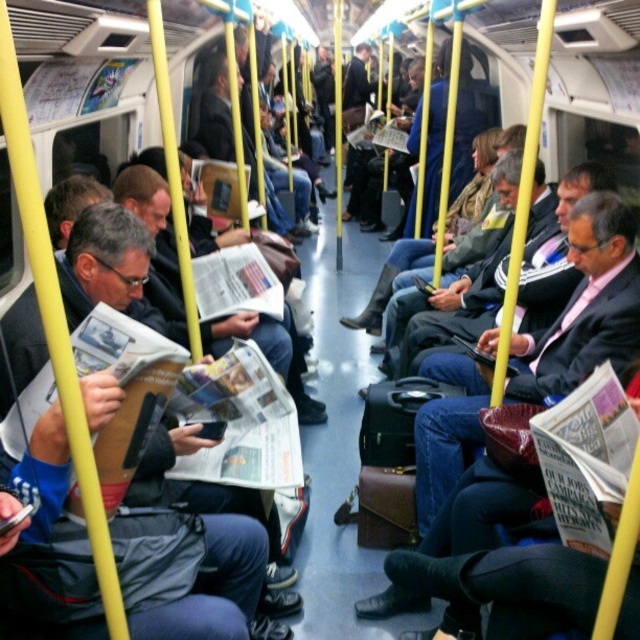
Which of these two, matte black jacket at left or dark blue suit at center, stands shorter?

dark blue suit at center

Does matte black jacket at left have a lesser height compared to dark blue suit at center?

In fact, matte black jacket at left may be taller than dark blue suit at center.

The height and width of the screenshot is (640, 640). I want to click on matte black jacket at left, so click(x=193, y=573).

The height and width of the screenshot is (640, 640). Find the location of `matte black jacket at left`. matte black jacket at left is located at coordinates (193, 573).

Is point (106, 380) in front of point (461, 406)?

Yes, point (106, 380) is in front of point (461, 406).

How far apart are matte black jacket at left and matte black suit at center?

The distance of matte black jacket at left from matte black suit at center is 1.35 meters.

Locate an element on the screen. This screenshot has width=640, height=640. matte black jacket at left is located at coordinates coord(193,573).

Is dark blue suit at center smaller than matte black newspaper at center?

Correct, dark blue suit at center occupies less space than matte black newspaper at center.

Who is more distant from viewer, [557,284] or [278,340]?

The point [278,340] is behind.

Where is `dark blue suit at center`? dark blue suit at center is located at coordinates (554, 252).